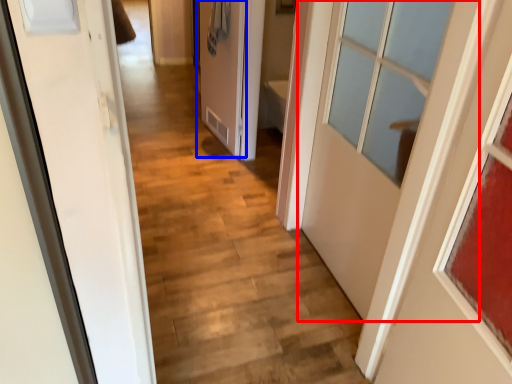
Question: Which of the following is the farthest to the observer, door (highlighted by a red box) or door (highlighted by a blue box)?

Choices:
 (A) door
 (B) door

Answer: (B)